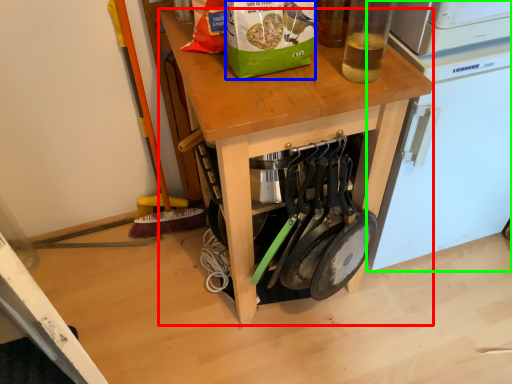
Question: Estimate the real-world distances between objects in this image. Which object is farther from desk (highlighted by a red box), paper bag (highlighted by a blue box) or home appliance (highlighted by a green box)?

Choices:
 (A) paper bag
 (B) home appliance

Answer: (B)